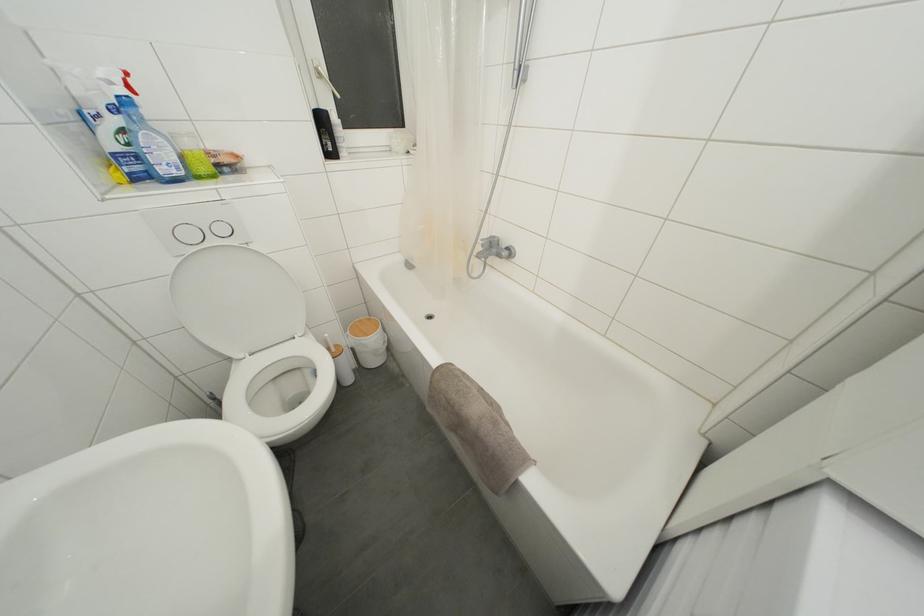
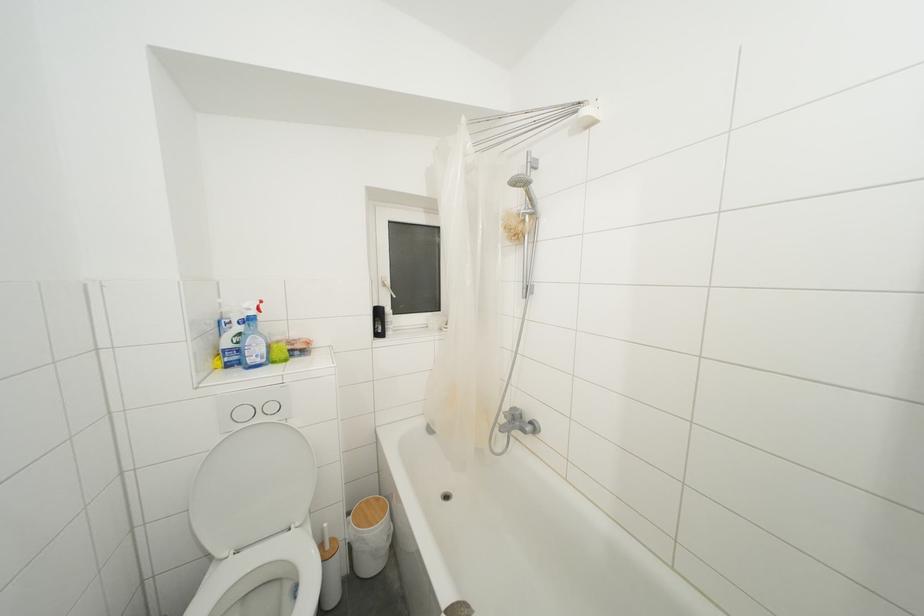
Question: Based on the continuous images, in which direction is the camera rotating? Reply with the corresponding letter.

Choices:
 (A) Left
 (B) Right
 (C) Up
 (D) Down

Answer: (C)